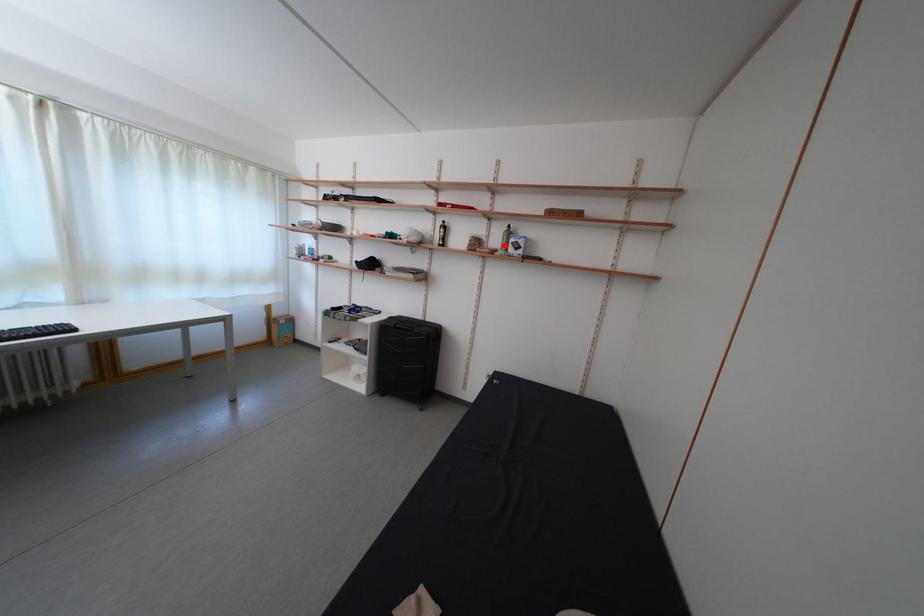
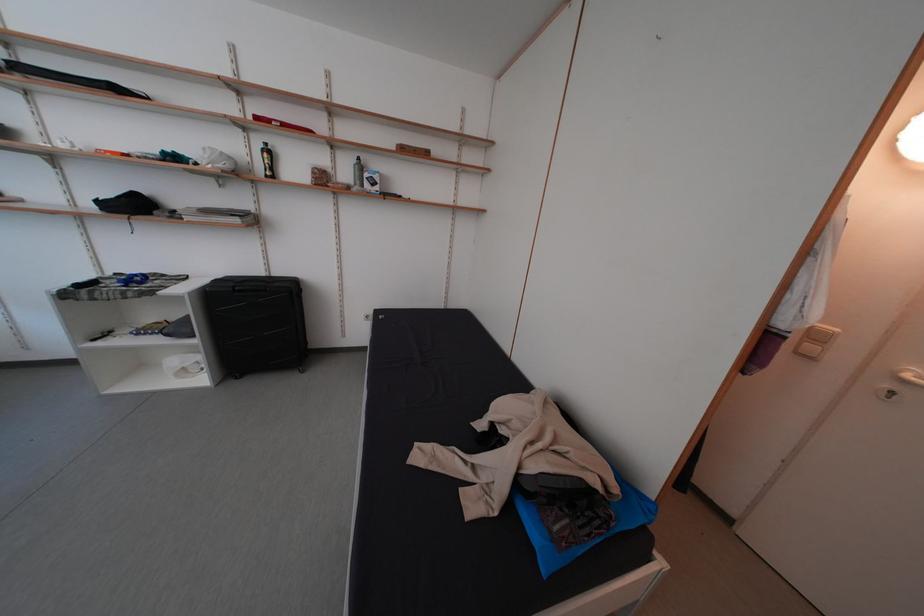
Where in the second image is the point corresponding to the highlighted location from the first image?

(354, 179)